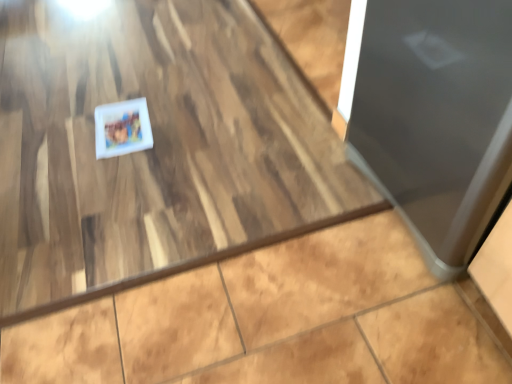
Question: Could you tell me if white matte postcard at center is facing glossy metallic door at right?

Choices:
 (A) yes
 (B) no

Answer: (B)

Question: Does white matte postcard at center have a larger size compared to glossy metallic door at right?

Choices:
 (A) no
 (B) yes

Answer: (A)

Question: Is glossy metallic door at right at the back of white matte postcard at center?

Choices:
 (A) no
 (B) yes

Answer: (A)

Question: Is white matte postcard at center at the left side of glossy metallic door at right?

Choices:
 (A) yes
 (B) no

Answer: (A)

Question: Considering the relative sizes of white matte postcard at center and glossy metallic door at right in the image provided, is white matte postcard at center shorter than glossy metallic door at right?

Choices:
 (A) no
 (B) yes

Answer: (B)

Question: From the image's perspective, would you say white matte postcard at center is positioned over glossy metallic door at right?

Choices:
 (A) no
 (B) yes

Answer: (B)

Question: Does glossy metallic door at right turn towards white matte postcard at center?

Choices:
 (A) no
 (B) yes

Answer: (A)

Question: Is there a large distance between glossy metallic door at right and white matte postcard at center?

Choices:
 (A) yes
 (B) no

Answer: (B)

Question: From a real-world perspective, is glossy metallic door at right positioned under white matte postcard at center based on gravity?

Choices:
 (A) yes
 (B) no

Answer: (B)

Question: Does glossy metallic door at right have a smaller size compared to white matte postcard at center?

Choices:
 (A) yes
 (B) no

Answer: (B)

Question: From a real-world perspective, is glossy metallic door at right over white matte postcard at center?

Choices:
 (A) no
 (B) yes

Answer: (B)

Question: Is glossy metallic door at right not inside white matte postcard at center?

Choices:
 (A) yes
 (B) no

Answer: (A)

Question: Is point click(137, 99) positioned closer to the camera than point click(501, 36)?

Choices:
 (A) farther
 (B) closer

Answer: (A)